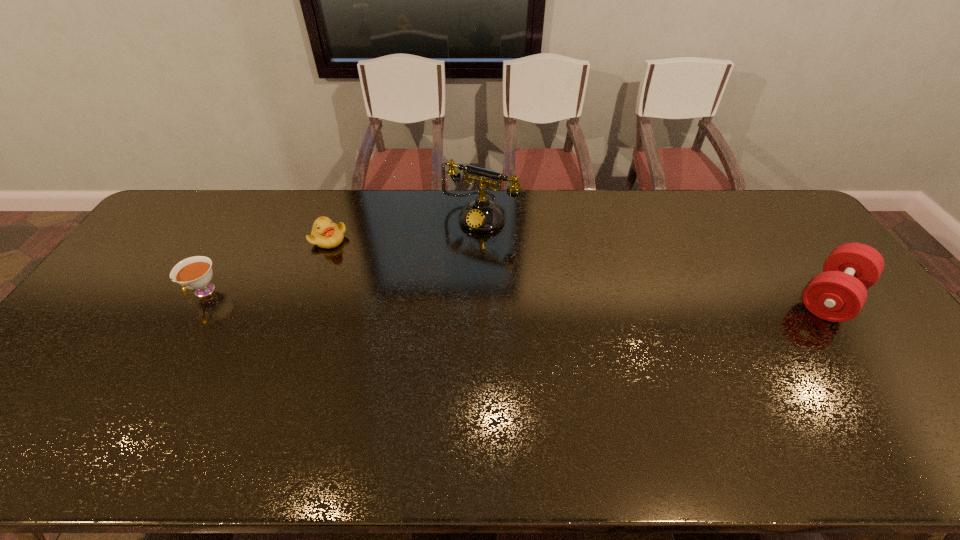
In order to click on teacup in this screenshot , I will do `click(195, 273)`.

Where is `the third shortest object`? the third shortest object is located at coordinates [838, 294].

You are a GUI agent. You are given a task and a screenshot of the screen. Output one action in this format:
    pyautogui.click(x=<x>, y=<y>)
    Task: Click on the rightmost object
    The image size is (960, 540).
    Given the screenshot: What is the action you would take?
    pyautogui.click(x=838, y=294)

You are a GUI agent. You are given a task and a screenshot of the screen. Output one action in this format:
    pyautogui.click(x=<x>, y=<y>)
    Task: Click on the tallest object
    
    Given the screenshot: What is the action you would take?
    pyautogui.click(x=482, y=215)

Image resolution: width=960 pixels, height=540 pixels. Identify the location of telephone. (482, 215).

Where is `the second object from left to right`? Image resolution: width=960 pixels, height=540 pixels. the second object from left to right is located at coordinates (325, 234).

The height and width of the screenshot is (540, 960). In order to click on free space located on the side of the leftmost object with the handle in this screenshot , I will do `click(146, 391)`.

Identify the location of vacant space located 0.110m on the front of the dumbbell. (882, 366).

Locate an element on the screen. The width and height of the screenshot is (960, 540). free space located on the dial of the tallest object is located at coordinates (448, 253).

Where is `vacant area situated on the dial of the tallest object`? The image size is (960, 540). vacant area situated on the dial of the tallest object is located at coordinates (425, 285).